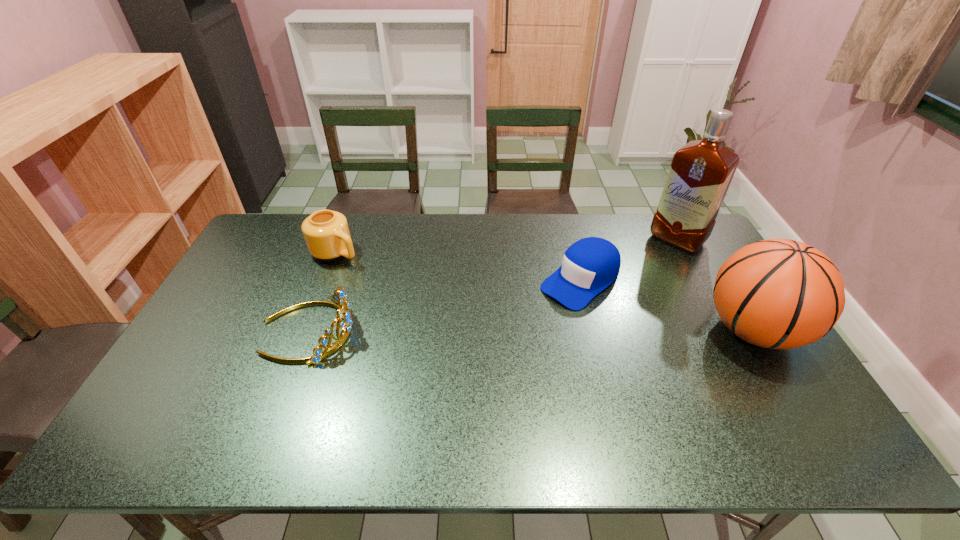
This screenshot has width=960, height=540. Find the location of `vacant spot on the desktop that is between the tiara and the fourth shortest object and is positioned on the front-facing side of the baseball cap`. vacant spot on the desktop that is between the tiara and the fourth shortest object and is positioned on the front-facing side of the baseball cap is located at coordinates (518, 330).

Identify the location of free space on the desktop that is between the tiara and the basketball and is positioned on the front label of the tallest object. (587, 330).

Find the location of `free space on the desktop that is between the tiara and the second tallest object and is positioned on the handle side of the mug`. free space on the desktop that is between the tiara and the second tallest object and is positioned on the handle side of the mug is located at coordinates (464, 330).